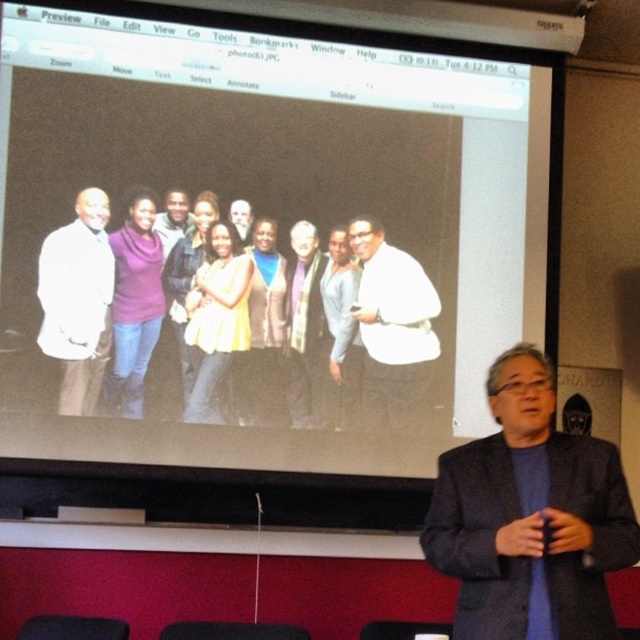
Who is taller, white matte projection screen at upper center or white matte shirt at center?

white matte projection screen at upper center

Between white matte projection screen at upper center and white matte shirt at center, which one has less height?

white matte shirt at center

Image resolution: width=640 pixels, height=640 pixels. Find the location of `white matte projection screen at upper center`. white matte projection screen at upper center is located at coordinates (268, 230).

Which is more to the left, white matte shirt at center or purple sweater at center?

purple sweater at center is more to the left.

Does white matte shirt at center have a lesser width compared to purple sweater at center?

No, white matte shirt at center is not thinner than purple sweater at center.

Image resolution: width=640 pixels, height=640 pixels. Identify the location of white matte shirt at center. (392, 324).

Can you confirm if white matte jacket at left is thinner than white matte beard at center?

No, white matte jacket at left is not thinner than white matte beard at center.

Can you confirm if white matte jacket at left is positioned to the left of white matte beard at center?

Indeed, white matte jacket at left is positioned on the left side of white matte beard at center.

Locate an element on the screen. The width and height of the screenshot is (640, 640). white matte jacket at left is located at coordinates (77, 300).